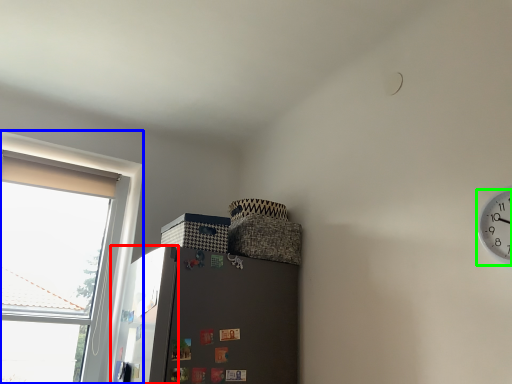
Question: Considering the real-world distances, which object is farthest from screen door (highlighted by a red box)? window (highlighted by a blue box) or clock (highlighted by a green box)?

Choices:
 (A) window
 (B) clock

Answer: (B)